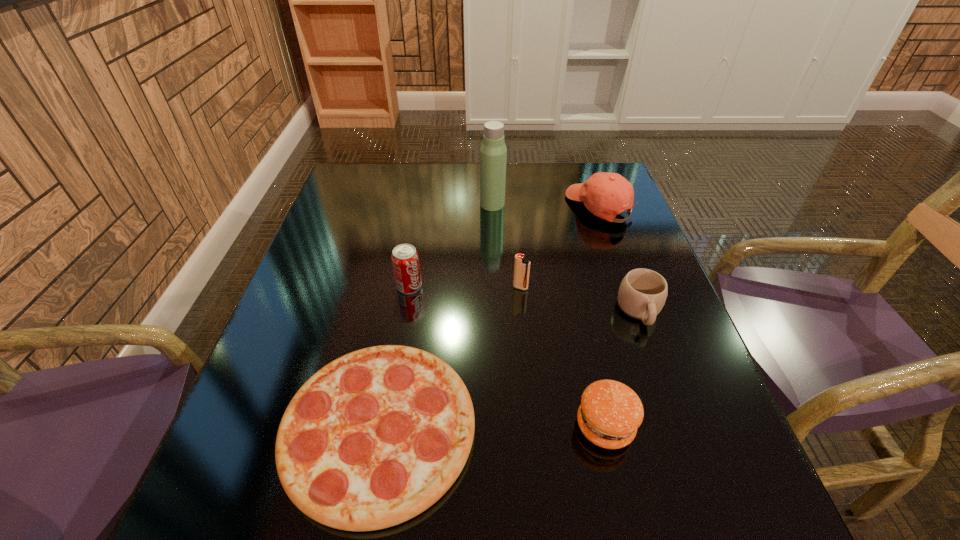
Locate an element on the screen. The width and height of the screenshot is (960, 540). free space located on the right of the soda can is located at coordinates (513, 286).

Find the location of a particular element. This screenshot has width=960, height=540. free space located 0.360m on the back of the fourth object from left to right is located at coordinates (512, 198).

Where is `vacant space located 0.360m on the left of the patty`? Image resolution: width=960 pixels, height=540 pixels. vacant space located 0.360m on the left of the patty is located at coordinates (369, 426).

At what (x,y) coordinates should I click in order to perform the action: click on vacant space located 0.050m on the side of the mug with the handle. Please return your answer as a coordinate pair (x, y). Looking at the image, I should click on (655, 352).

This screenshot has width=960, height=540. I want to click on free spot located on the right of the pizza, so click(x=602, y=429).

Locate an element on the screen. thermos bottle present at the far edge is located at coordinates (493, 153).

At what (x,y) coordinates should I click in order to perform the action: click on baseball cap present at the far edge. Please return your answer as a coordinate pair (x, y). The width and height of the screenshot is (960, 540). Looking at the image, I should click on (604, 194).

At what (x,y) coordinates should I click in order to perform the action: click on object present at the near edge. Please return your answer as a coordinate pair (x, y). Looking at the image, I should click on (374, 438).

Where is `object present at the left edge`? object present at the left edge is located at coordinates (374, 438).

This screenshot has width=960, height=540. I want to click on baseball cap located in the right edge section of the desktop, so click(604, 194).